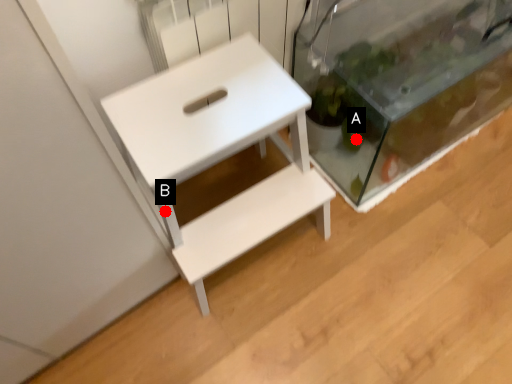
Question: Two points are circled on the image, labeled by A and B beside each circle. Which point is closer to the camera?

Choices:
 (A) A is closer
 (B) B is closer

Answer: (B)